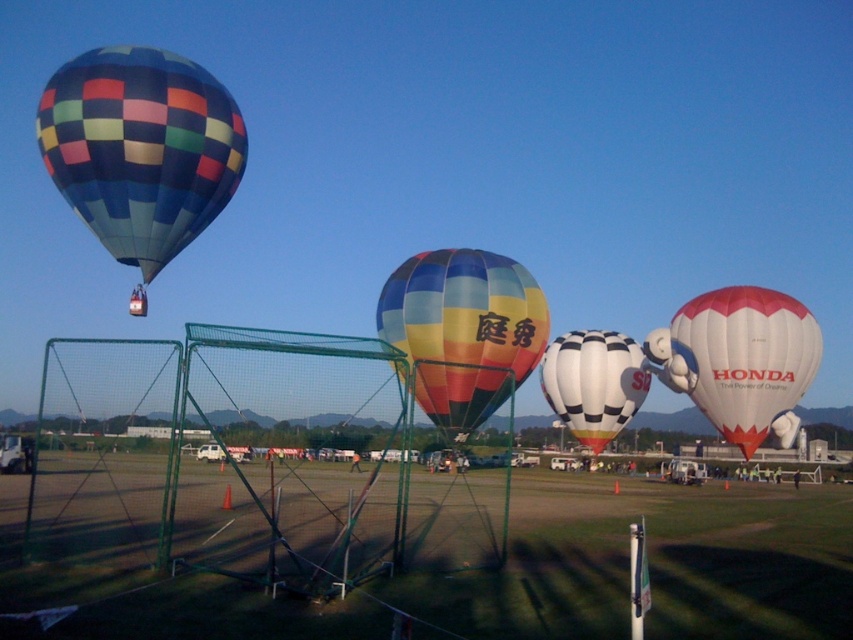
Question: Does green grass at center come in front of white/red fabric balloon at right?

Choices:
 (A) no
 (B) yes

Answer: (B)

Question: Which object is closer to the camera taking this photo?

Choices:
 (A) rainbow fabric hot air balloon at center
 (B) white/red fabric balloon at right
 (C) green grass at center
 (D) black and white checkered hot air balloon at center

Answer: (C)

Question: From the image, what is the correct spatial relationship of white/red fabric balloon at right in relation to black and white checkered hot air balloon at center?

Choices:
 (A) left
 (B) right

Answer: (B)

Question: In this image, where is checkerboard fabric hot air balloon at left located relative to rainbow fabric hot air balloon at center?

Choices:
 (A) left
 (B) right

Answer: (A)

Question: Which of the following is the closest to the observer?

Choices:
 (A) rainbow fabric hot air balloon at center
 (B) black and white checkered hot air balloon at center

Answer: (A)

Question: Estimate the real-world distances between objects in this image. Which object is closer to the rainbow fabric hot air balloon at center?

Choices:
 (A) black and white checkered hot air balloon at center
 (B) green grass at center

Answer: (B)